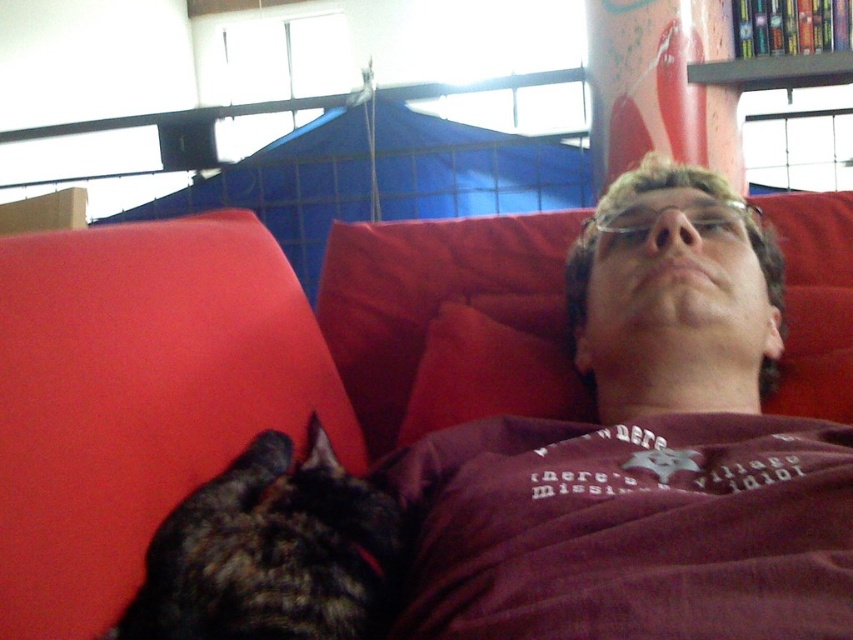
Question: Does red fabric couch at upper center come behind red fabric pillow at upper center?

Choices:
 (A) yes
 (B) no

Answer: (B)

Question: Does dark fur cat at lower left come in front of pink wood bookshelf at upper right?

Choices:
 (A) no
 (B) yes

Answer: (B)

Question: Estimate the real-world distances between objects in this image. Which object is closer to the red fabric pillow at upper center?

Choices:
 (A) dark fur cat at lower left
 (B) pink wood bookshelf at upper right

Answer: (A)

Question: Which point appears closest to the camera in this image?

Choices:
 (A) (834, 61)
 (B) (519, 348)
 (C) (390, 545)
 (D) (218, 358)

Answer: (C)

Question: Where is red fabric couch at upper center located in relation to red fabric pillow at upper center in the image?

Choices:
 (A) above
 (B) below

Answer: (A)

Question: Which object appears closest to the camera in this image?

Choices:
 (A) dark fur cat at lower left
 (B) red fabric pillow at upper center
 (C) red fabric couch at upper center
 (D) pink wood bookshelf at upper right

Answer: (C)